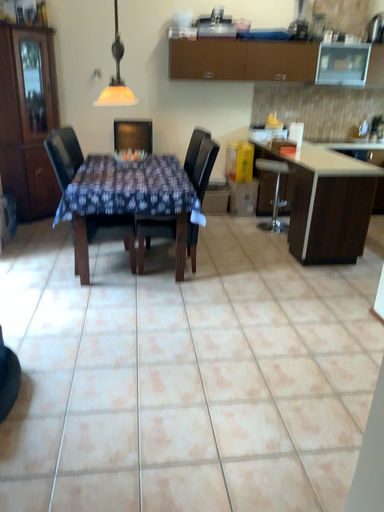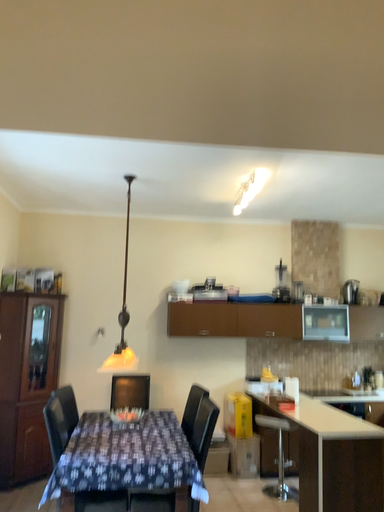
Question: How did the camera likely rotate when shooting the video?

Choices:
 (A) rotated upward
 (B) rotated downward

Answer: (A)